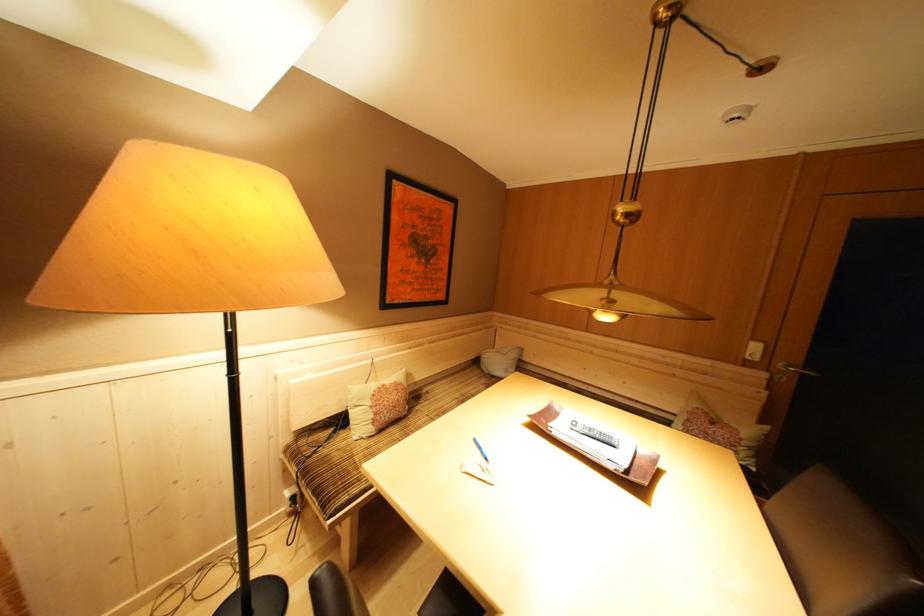
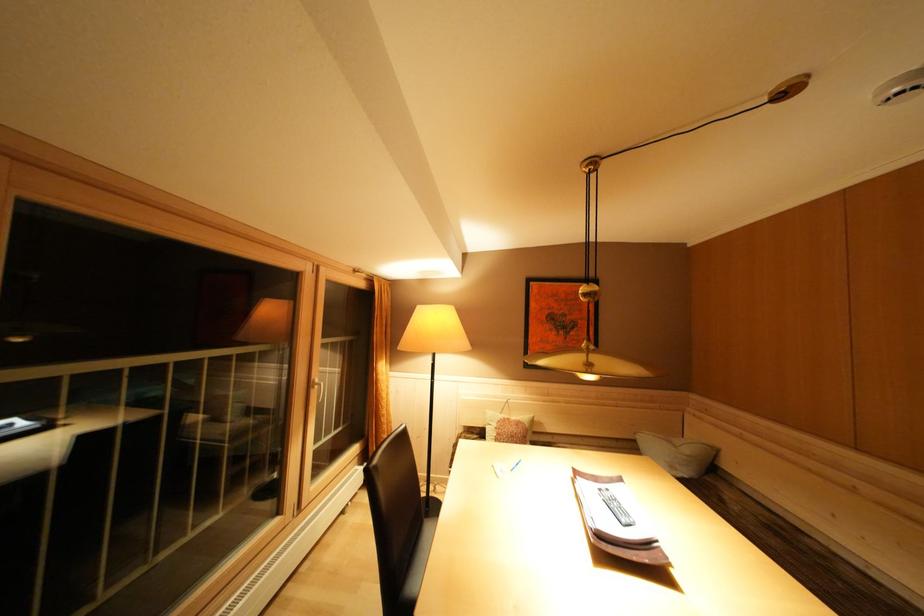
In the second image, find the point that corresponds to point (519, 361) in the first image.

(695, 456)